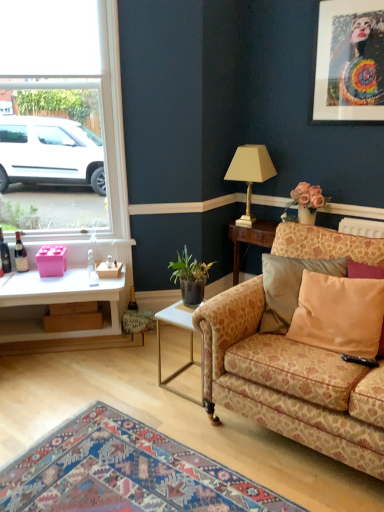
The width and height of the screenshot is (384, 512). In order to click on free space to the right of matte glass bottle at left, the 1th bottle when ordered from left to right in this screenshot , I will do `click(22, 273)`.